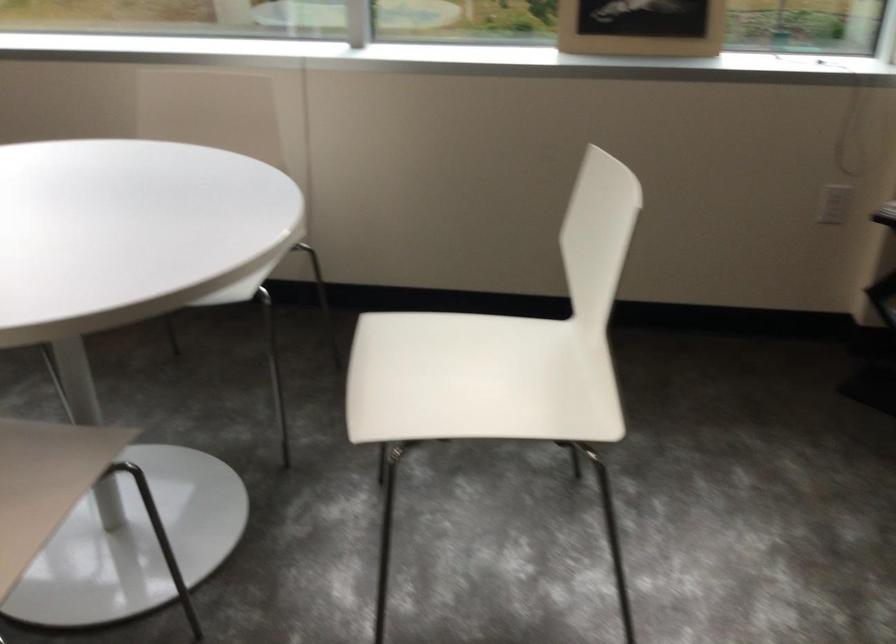
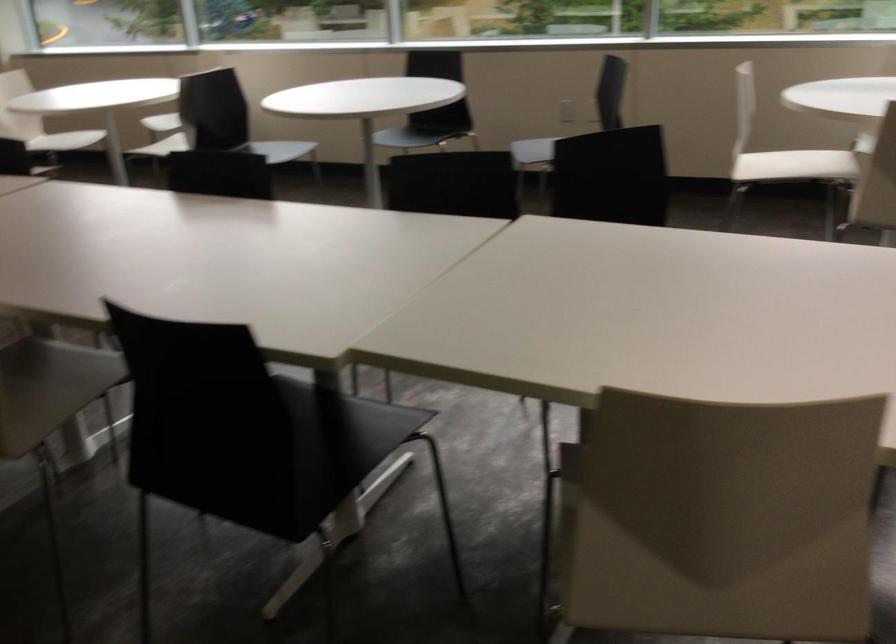
What movement of the cameraman would produce the second image?

The cameraman walked toward left, backward.